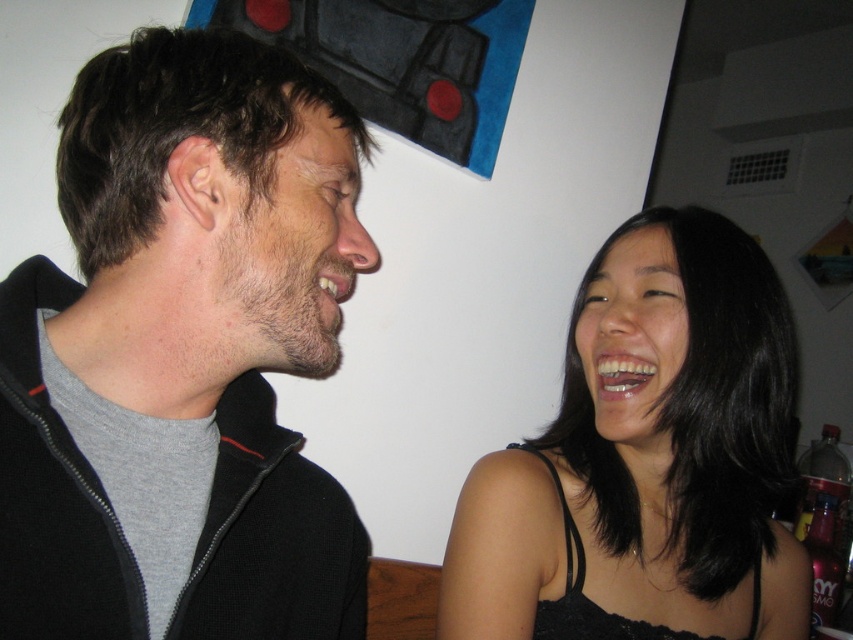
You are an artist preparing to sketch two faces in the scene. The beige matte face at left and the smooth skin face at center are both in your view. Based on the description, which face should you focus on first if you want to capture the one that is wider?

The beige matte face at left might be wider than smooth skin face at center, so you should focus on the beige matte face at left first to capture its width.

You are a photographer setting up for a portrait shoot. You need to ensure there is enough space between the two subjects wearing the black matte jacket at left and the black satin tank top at right to avoid them appearing too cramped in the frame. Given that the minimum recommended distance for a natural pose is 12 inches, can they maintain this distance?

The black matte jacket at left is 13.60 inches away from the black satin tank top at right, which exceeds the minimum recommended distance of 12 inches. Therefore, they can maintain the required space for a natural pose.